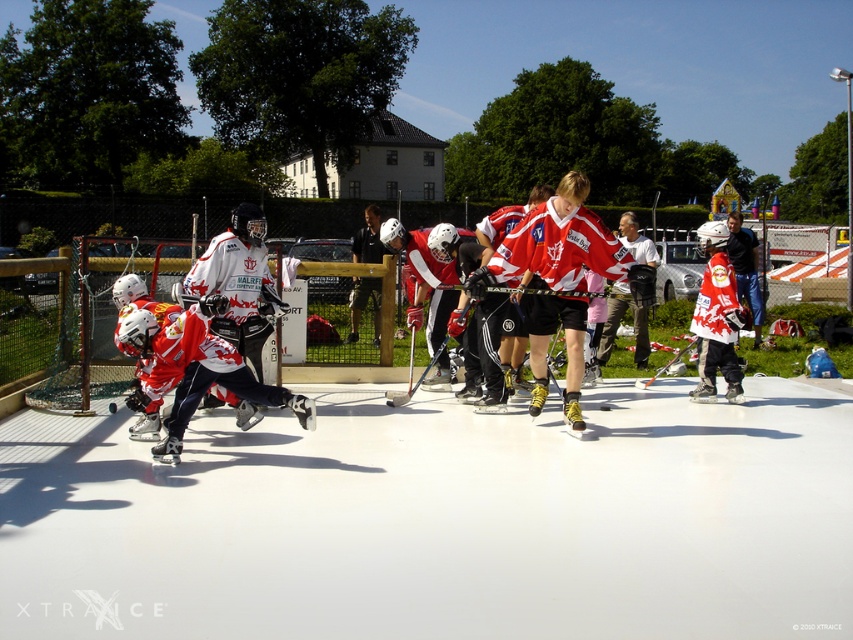
You are a spectator at the ice hockey rink and want to take a photo of both the black leather jacket at center and the black glossy hockey stick at center. Which object should you zoom in on first to ensure it appears larger in your photo?

The black leather jacket at center is bigger than the black glossy hockey stick at center, so you should zoom in on the black leather jacket at center first to ensure it appears larger in your photo.

You are a photographer standing at the edge of the ice hockey rink. You want to take a photo of the black glossy hockey stick at center without the black leather jacket at center blocking the view. Is this possible given their positions?

The black leather jacket at center is further to the viewer than the black glossy hockey stick at center, so the jacket would block the hockey stick from view. Therefore, it is not possible to take a photo of the black glossy hockey stick at center without the black leather jacket at center blocking the view.